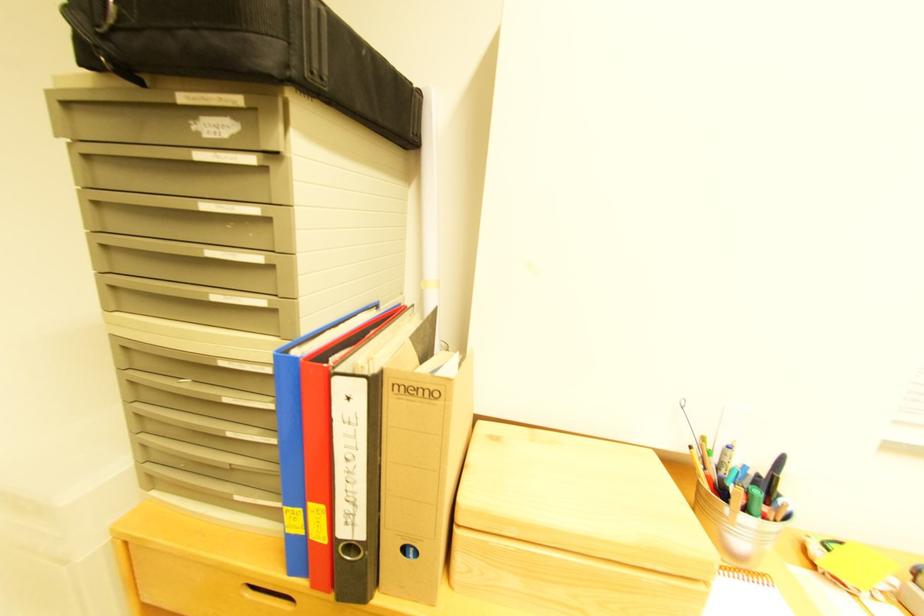
I want to click on recessed drawer handle, so click(x=268, y=596).